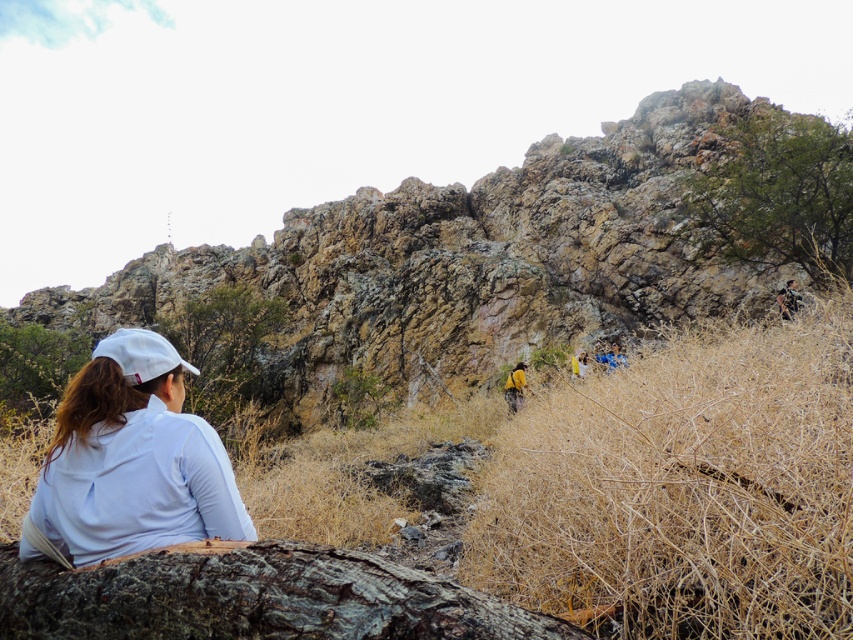
Based on the photo, you are a hiker who has just arrived at this scenic spot. You notice the dark brown rough bark at lower center and the blue fabric at center. Which object is wider from your perspective?

The dark brown rough bark at lower center might be wider than blue fabric at center according to the description provided.

You are a photographer trying to capture a photo of the blue fabric at center. You notice the white matte shirt at lower left might block the view. Based on their sizes, which object would you need to adjust your camera angle to avoid?

The white matte shirt at lower left is larger in width than the blue fabric at center, so you would need to adjust your camera angle to avoid the white matte shirt at lower left.

In the scene shown: You are a hiker who wants to place a blue fabric at center on the rugged rock formation at upper center. Can you place it there?

The rugged rock formation at upper center is to the left of blue fabric at center, so the blue fabric at center is not positioned on the rugged rock formation at upper center. You cannot place it there as they are separate objects in the scene.